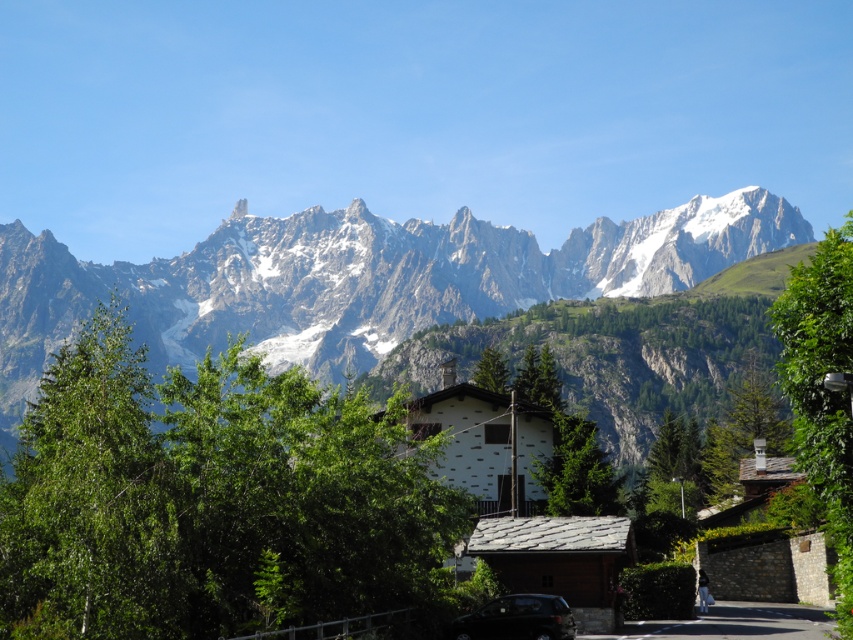
Which of these two, white rocky mountain range at upper center or gray asphalt road at lower center, stands taller?

white rocky mountain range at upper center is taller.

Is white rocky mountain range at upper center taller than gray asphalt road at lower center?

Yes.

Where is `white rocky mountain range at upper center`? The height and width of the screenshot is (640, 853). white rocky mountain range at upper center is located at coordinates (358, 280).

Find the location of a particular element. This screenshot has height=640, width=853. white rocky mountain range at upper center is located at coordinates (358, 280).

Which is above, white rocky mountain range at upper center or metallic dark gray car at center?

white rocky mountain range at upper center is higher up.

Where is `white rocky mountain range at upper center`? white rocky mountain range at upper center is located at coordinates [358, 280].

Image resolution: width=853 pixels, height=640 pixels. What do you see at coordinates (358, 280) in the screenshot? I see `white rocky mountain range at upper center` at bounding box center [358, 280].

This screenshot has height=640, width=853. I want to click on white rocky mountain range at upper center, so click(x=358, y=280).

Is the position of gray asphalt road at lower center less distant than that of metallic dark gray car at center?

That is False.

Is gray asphalt road at lower center positioned behind metallic dark gray car at center?

Yes, gray asphalt road at lower center is further from the viewer.

You are a GUI agent. You are given a task and a screenshot of the screen. Output one action in this format:
    pyautogui.click(x=<x>, y=<y>)
    Task: Click on the gray asphalt road at lower center
    Image resolution: width=853 pixels, height=640 pixels.
    Given the screenshot: What is the action you would take?
    735,624